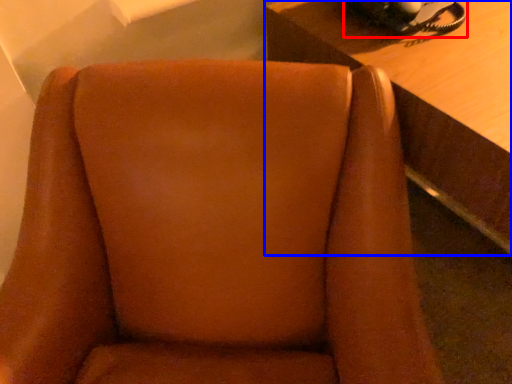
Question: Which object is further to the camera taking this photo, corded phone (highlighted by a red box) or table (highlighted by a blue box)?

Choices:
 (A) corded phone
 (B) table

Answer: (A)